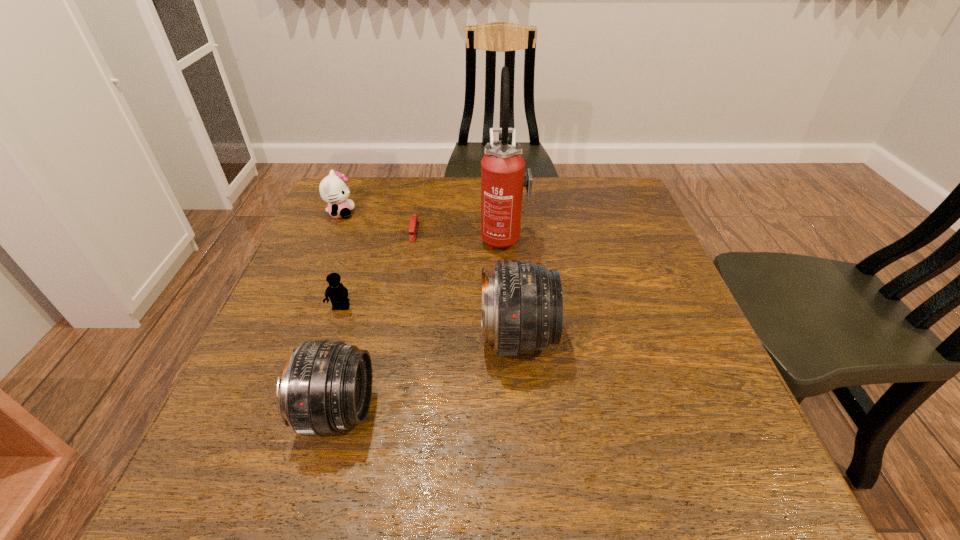
Image resolution: width=960 pixels, height=540 pixels. I want to click on stapler that is at the far edge, so click(413, 227).

Locate an element on the screen. The width and height of the screenshot is (960, 540). object located in the near edge section of the desktop is located at coordinates (326, 386).

Locate an element on the screen. This screenshot has width=960, height=540. telephoto lens at the left edge is located at coordinates (326, 386).

Identify the location of kitten that is at the left edge. This screenshot has width=960, height=540. tap(333, 189).

You are a GUI agent. You are given a task and a screenshot of the screen. Output one action in this format:
    pyautogui.click(x=<x>, y=<y>)
    Task: Click on the Lego that is positioned at the left edge
    Image resolution: width=960 pixels, height=540 pixels.
    Given the screenshot: What is the action you would take?
    pyautogui.click(x=338, y=294)

The width and height of the screenshot is (960, 540). What are the coordinates of `object that is at the far left corner` in the screenshot? It's located at (333, 189).

The image size is (960, 540). Find the location of `object present at the near left corner`. object present at the near left corner is located at coordinates (326, 386).

I want to click on free space at the far edge, so click(x=479, y=193).

Locate an element on the screen. vacant space at the near edge of the desktop is located at coordinates (384, 392).

In the image, there is a desktop. At what (x,y) coordinates should I click in order to perform the action: click on vacant space at the left edge. Please return your answer as a coordinate pair (x, y). Looking at the image, I should click on (315, 279).